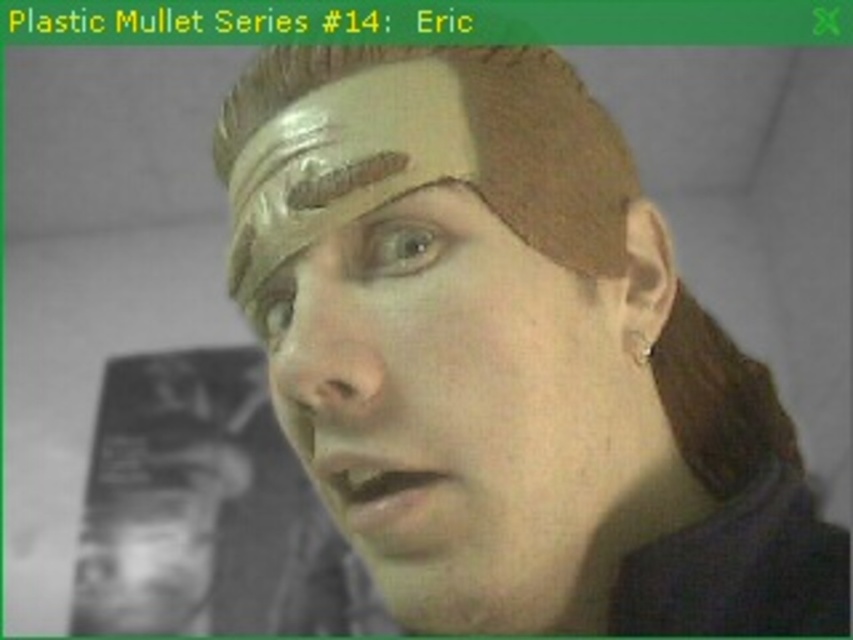
Question: Estimate the real-world distances between objects in this image. Which object is farther from the brown matte eye at center?

Choices:
 (A) matte gold eyebrow at upper center
 (B) matte plastic face at center

Answer: (B)

Question: Which is nearer to the brown matte eye at center?

Choices:
 (A) light brown matte eye at center
 (B) matte plastic face at center
 (C) matte gold eyebrow at upper center
 (D) smooth plastic head at lower left

Answer: (C)

Question: Is brown matte eye at center wider than light brown matte eye at center?

Choices:
 (A) no
 (B) yes

Answer: (B)

Question: Which point is closer to the camera?

Choices:
 (A) (169, 522)
 (B) (415, 184)
 (C) (659, 428)

Answer: (B)

Question: Can you confirm if matte plastic face at center is thinner than smooth plastic head at lower left?

Choices:
 (A) no
 (B) yes

Answer: (B)

Question: From the image, what is the correct spatial relationship of light brown matte eye at center in relation to matte gold eyebrow at upper center?

Choices:
 (A) left
 (B) right

Answer: (A)